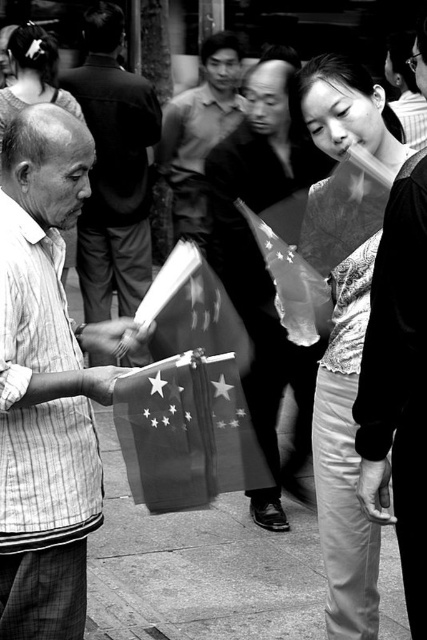
Question: Does paper flag at center come behind smooth fabric shirt at center?

Choices:
 (A) yes
 (B) no

Answer: (B)

Question: Does smooth black bag at center come behind paper flag at center?

Choices:
 (A) no
 (B) yes

Answer: (B)

Question: Estimate the real-world distances between objects in this image. Which object is closer to the shiny metallic flag at center?

Choices:
 (A) smooth fabric shirt at center
 (B) smooth black bag at center
 (C) paper flag at center

Answer: (C)

Question: Which object is positioned closest to the smooth black bag at center?

Choices:
 (A) smooth paper bag at center
 (B) striped fabric shirt at left

Answer: (B)

Question: Does smooth black bag at center have a greater width compared to smooth paper bag at center?

Choices:
 (A) yes
 (B) no

Answer: (B)

Question: Estimate the real-world distances between objects in this image. Which object is farther from the smooth fabric shirt at center?

Choices:
 (A) shiny metallic flag at center
 (B) striped fabric shirt at left
 (C) paper flag at center
 (D) smooth black bag at center

Answer: (B)